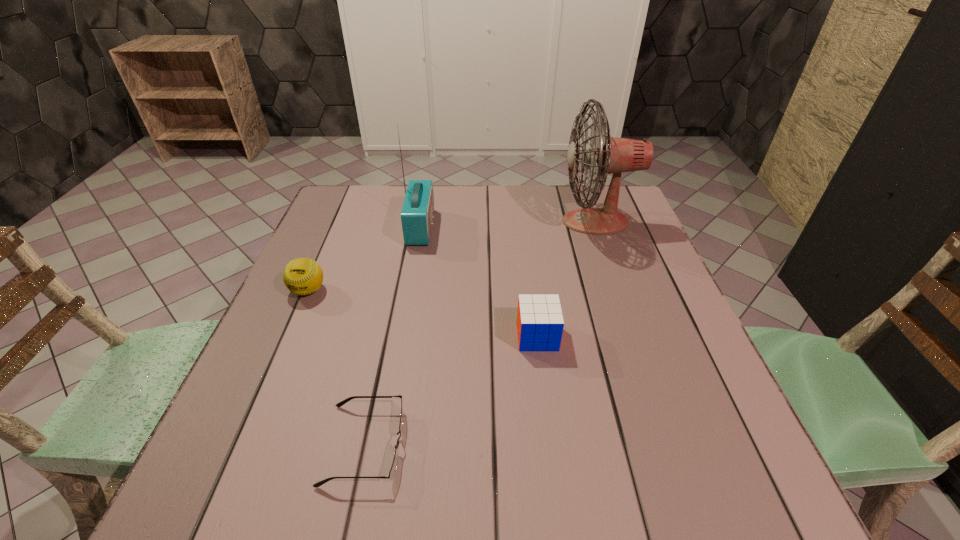
At what (x,y) coordinates should I click in order to perform the action: click on free point located 0.400m in front of the fan to direct airflow. Please return your answer as a coordinate pair (x, y). This screenshot has height=540, width=960. Looking at the image, I should click on (420, 221).

The width and height of the screenshot is (960, 540). I want to click on vacant space located in front of the fan to direct airflow, so click(x=531, y=221).

The image size is (960, 540). Identify the location of vacant space located on the front panel of the radio receiver. (477, 227).

In order to click on free space located on the logo side of the softball in this screenshot , I will do `click(268, 383)`.

This screenshot has height=540, width=960. In order to click on vacant space located on the back of the second object from right to left in this screenshot , I will do `click(524, 234)`.

Identify the location of vacant space located 0.180m on the front-facing side of the spectacles. The width and height of the screenshot is (960, 540). (508, 444).

Where is `fan that is at the far edge`? This screenshot has height=540, width=960. fan that is at the far edge is located at coordinates [x=604, y=155].

The image size is (960, 540). Identify the location of radio receiver positioned at the far edge. (417, 214).

Where is `object that is at the near edge`? This screenshot has height=540, width=960. object that is at the near edge is located at coordinates (393, 469).

At what (x,y) coordinates should I click in order to perform the action: click on object located at the left edge. Please return your answer as a coordinate pair (x, y). Image resolution: width=960 pixels, height=540 pixels. Looking at the image, I should click on (303, 276).